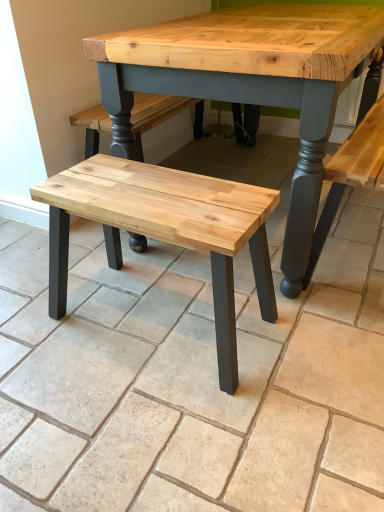
The width and height of the screenshot is (384, 512). I want to click on free region under natural wood stool at center (from a real-world perspective), so click(x=158, y=315).